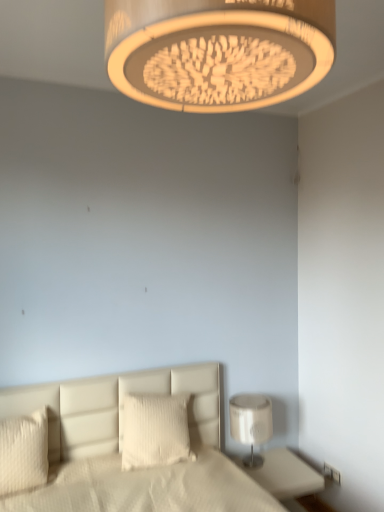
Question: Considering the relative sizes of white plastic electric outlet at lower right and white textured pillow at lower left, the first pillow viewed from the front, in the image provided, is white plastic electric outlet at lower right wider than white textured pillow at lower left, the first pillow viewed from the front,?

Choices:
 (A) no
 (B) yes

Answer: (A)

Question: Could you tell me if white plastic electric outlet at lower right is facing white textured pillow at lower left, the first pillow viewed from the front?

Choices:
 (A) yes
 (B) no

Answer: (A)

Question: From the image's perspective, would you say white plastic electric outlet at lower right is positioned over white textured pillow at lower left, acting as the 2th pillow starting from the back?

Choices:
 (A) yes
 (B) no

Answer: (B)

Question: Can you confirm if white plastic electric outlet at lower right is shorter than white textured pillow at lower left, arranged as the 1th pillow when viewed from the left?

Choices:
 (A) yes
 (B) no

Answer: (A)

Question: From a real-world perspective, is white plastic electric outlet at lower right located higher than white textured pillow at lower left, the 2th pillow viewed from the right?

Choices:
 (A) no
 (B) yes

Answer: (A)

Question: From a real-world perspective, is white plastic electric outlet at lower right beneath white textured pillow at lower left, the first pillow viewed from the front?

Choices:
 (A) yes
 (B) no

Answer: (A)

Question: Can you confirm if matte beige lampshade at upper center, the first lamp in the left-to-right sequence, is taller than white plastic electric outlet at lower right?

Choices:
 (A) yes
 (B) no

Answer: (A)

Question: Is matte beige lampshade at upper center, the 1th lamp positioned from the front, oriented away from white plastic electric outlet at lower right?

Choices:
 (A) yes
 (B) no

Answer: (B)

Question: Considering the relative sizes of matte beige lampshade at upper center, marked as the second lamp in a bottom-to-top arrangement, and white plastic electric outlet at lower right in the image provided, is matte beige lampshade at upper center, marked as the second lamp in a bottom-to-top arrangement, shorter than white plastic electric outlet at lower right?

Choices:
 (A) no
 (B) yes

Answer: (A)

Question: Are matte beige lampshade at upper center, the second lamp in the right-to-left sequence, and white plastic electric outlet at lower right located far from each other?

Choices:
 (A) no
 (B) yes

Answer: (B)

Question: Is white plastic electric outlet at lower right inside matte beige lampshade at upper center, the 1th lamp positioned from the front?

Choices:
 (A) no
 (B) yes

Answer: (A)

Question: Is matte beige lampshade at upper center, the first lamp in the left-to-right sequence, located outside white plastic electric outlet at lower right?

Choices:
 (A) no
 (B) yes

Answer: (B)

Question: Is white glossy lamp at lower right, the first lamp from the back, inside white glossy nightstand at lower right?

Choices:
 (A) yes
 (B) no

Answer: (B)